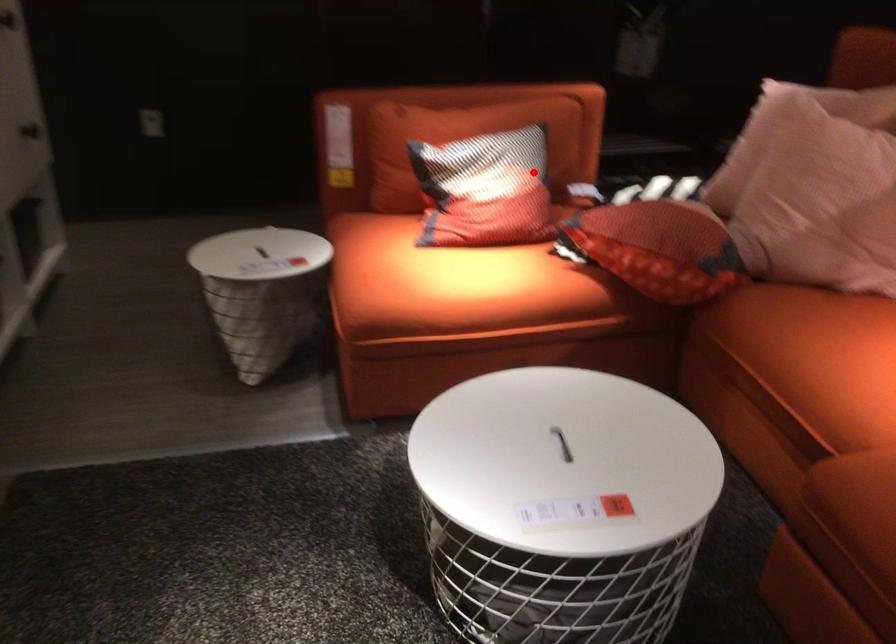
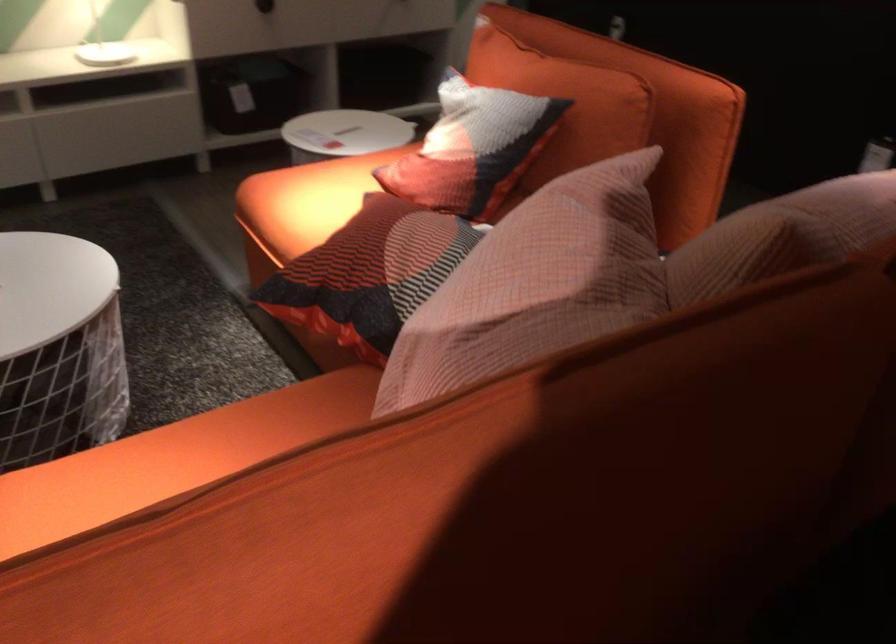
Question: A red point is marked in image1. In image2, is the corresponding 3D point closer to the camera or farther? Reply with the corresponding letter.

Choices:
 (A) The corresponding 3D point is closer.
 (B) The corresponding 3D point is farther.

Answer: (A)